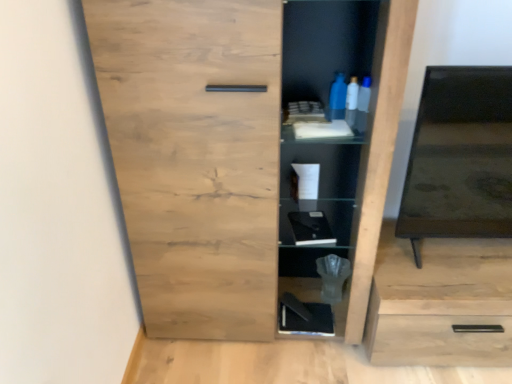
The height and width of the screenshot is (384, 512). What are the coordinates of `free spot below black glossy tv at right (from a real-world perspective)` in the screenshot? It's located at (459, 257).